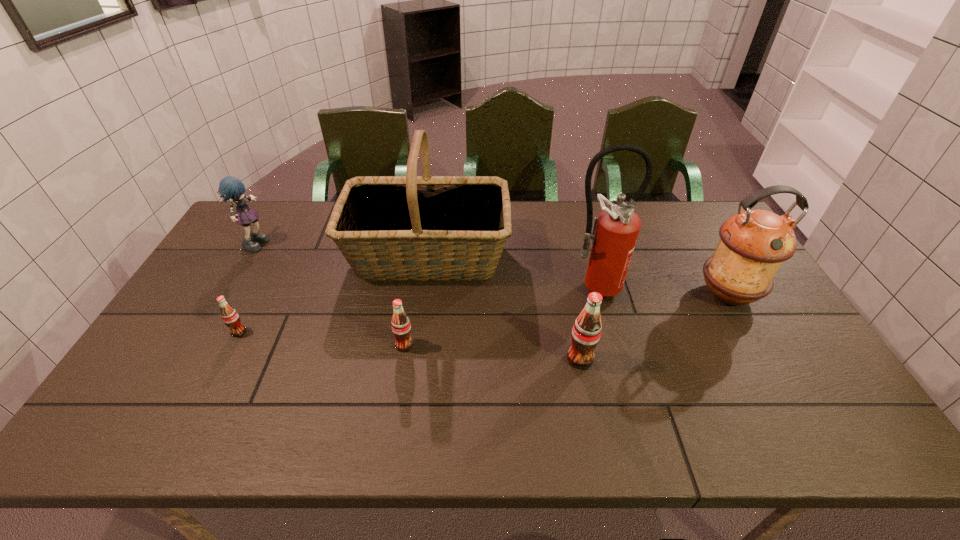
In order to click on the farthest soda in this screenshot , I will do `click(229, 315)`.

The width and height of the screenshot is (960, 540). I want to click on the sixth object from right to left, so click(x=229, y=315).

Locate an element on the screen. The image size is (960, 540). the second shortest soda is located at coordinates (401, 327).

Image resolution: width=960 pixels, height=540 pixels. I want to click on the sixth tallest object, so click(401, 327).

Identify the location of the tallest soda. This screenshot has width=960, height=540. (586, 332).

Locate an element on the screen. The height and width of the screenshot is (540, 960). basket is located at coordinates (411, 227).

Identify the location of the leftmost object. (230, 187).

Locate an element on the screen. oil lamp is located at coordinates (753, 244).

This screenshot has width=960, height=540. Identify the location of fire extinguisher. (615, 230).

Identify the location of free space located on the back of the fifth farthest object. (271, 271).